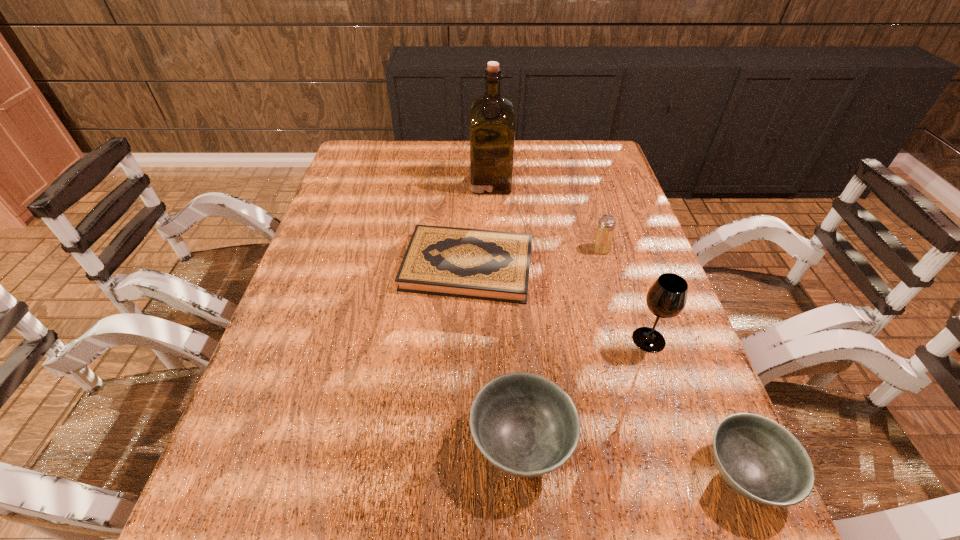
Where is `wineglass that is at the right edge`? Image resolution: width=960 pixels, height=540 pixels. wineglass that is at the right edge is located at coordinates (666, 298).

At what (x,y) coordinates should I click in order to perform the action: click on saltshaker that is at the right edge. Please return your answer as a coordinate pair (x, y). The image size is (960, 540). Looking at the image, I should click on (602, 242).

Locate an element on the screen. The width and height of the screenshot is (960, 540). object that is at the near right corner is located at coordinates (758, 458).

This screenshot has width=960, height=540. In the image, there is a desktop. Identify the location of vacant space at the far edge. (465, 174).

This screenshot has height=540, width=960. In the image, there is a desktop. In order to click on vacant area at the near edge in this screenshot , I will do `click(361, 475)`.

Find the location of a particular element. This screenshot has width=960, height=540. blank space at the left edge is located at coordinates (348, 183).

Identify the location of vacant space at the right edge of the desktop. (622, 300).

In the image, there is a desktop. Where is `vacant space at the far left corner`? This screenshot has width=960, height=540. vacant space at the far left corner is located at coordinates (378, 166).

Identify the location of vacant point at the far right corner. (563, 147).

The image size is (960, 540). Identify the location of vacant area that lies between the third nearest object and the fourth tallest object. (585, 391).